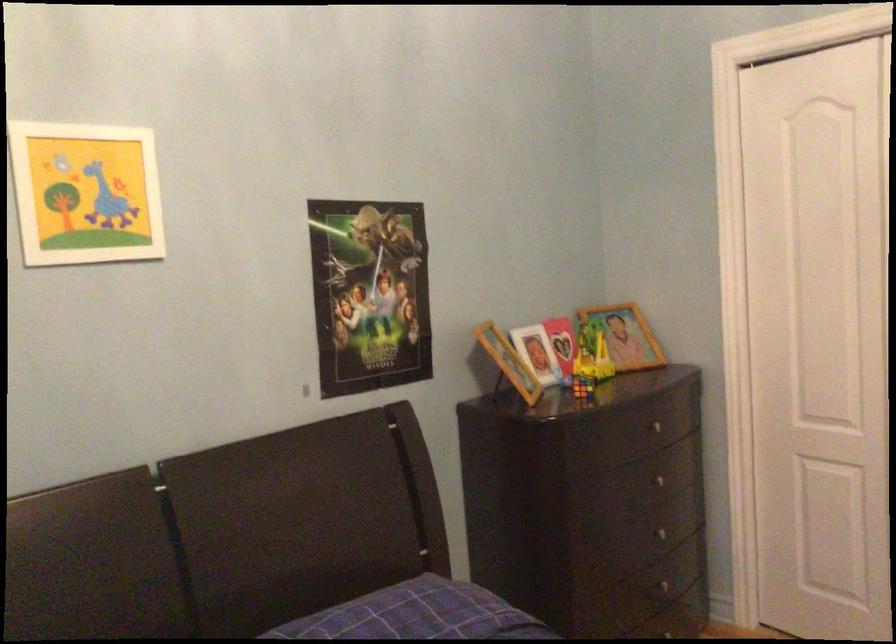
Image resolution: width=896 pixels, height=644 pixels. Identify the location of white picture frame. (85, 193).